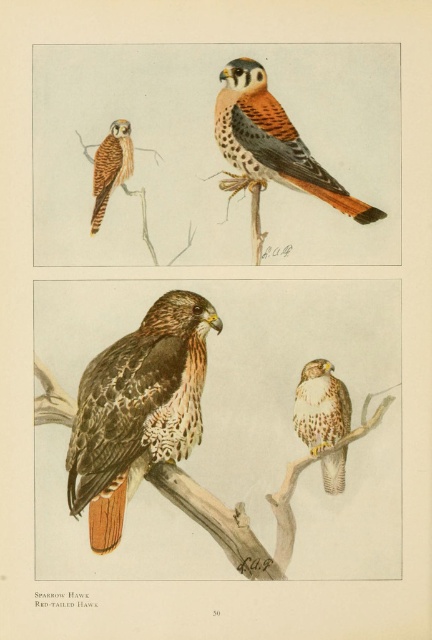
Which is more to the right, spotted feathered falcon at upper center or brown speckled falcon at center?

brown speckled falcon at center

Between point (270, 115) and point (336, 461), which one is positioned behind?

The point (270, 115) is more distant.

I want to click on spotted feathered falcon at upper center, so click(x=270, y=141).

Which of these two, spotted feathered falcon at upper center or spotted feathered falcon at upper left, stands shorter?

spotted feathered falcon at upper left is shorter.

Who is more distant from viewer, (380, 216) or (94, 216)?

Positioned behind is point (94, 216).

Which is behind, point (276, 150) or point (127, 152)?

The point (127, 152) is behind.

Identify the location of spotted feathered falcon at upper center. The image size is (432, 640). (270, 141).

Which of these two, brown speckled feathers at center or brown speckled falcon at center, stands taller?

With more height is brown speckled feathers at center.

Does brown speckled feathers at center have a lesser width compared to brown speckled falcon at center?

In fact, brown speckled feathers at center might be wider than brown speckled falcon at center.

In the scene shown: Who is more forward, [94,499] or [299,380]?

Positioned in front is point [94,499].

Locate an element on the screen. brown speckled feathers at center is located at coordinates (137, 410).